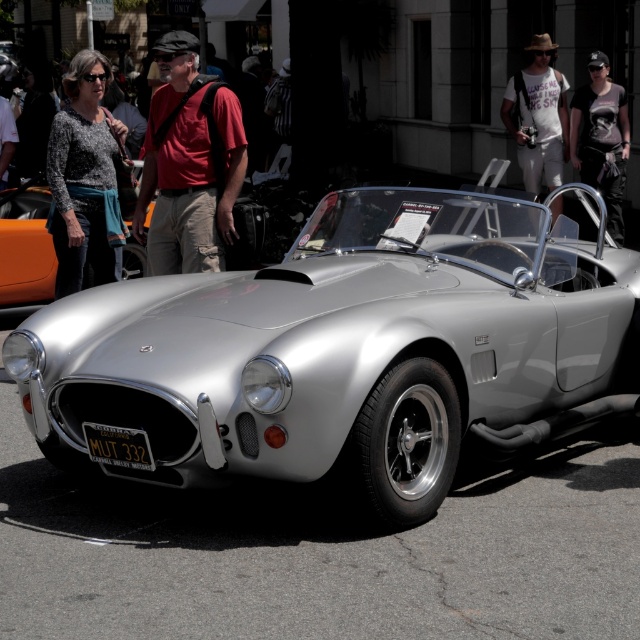
You are standing at the front of the classic silver sports car and want to greet the person wearing the matte red shirt at center. In which direction should you walk to reach them?

The matte red shirt at center is located at point (188, 163), so you should walk towards the center of the image to reach them.

You are standing in front of the classic silver sports car at the event. You notice a person wearing a specific item at the center. What color is the shirt of the person at point (188, 163)?

The shirt at point (188, 163) is matte red.